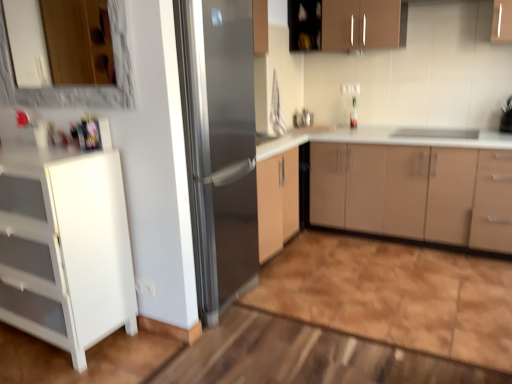
Question: From a real-world perspective, is matte beige cabinet at center, which appears as the second cabinetry when viewed from the top, positioned above or below white glossy cabinet at left, which appears as the third cabinetry when viewed from the top?

Choices:
 (A) below
 (B) above

Answer: (A)

Question: In the image, is matte beige cabinet at center, which is the second cabinetry from bottom to top, positioned in front of or behind white glossy cabinet at left, the 1th cabinetry from the left?

Choices:
 (A) front
 (B) behind

Answer: (B)

Question: Which is nearer to the stainless steel refrigerator at center?

Choices:
 (A) brown matte cabinet at upper center, the third cabinetry when ordered from bottom to top
 (B) satin nickel faucet at upper center
 (C) matte beige cabinet at center, which appears as the second cabinetry when viewed from the top
 (D) white glossy cabinet at left, which ranks as the third cabinetry in right-to-left order
 (E) wooden frame mirror at upper left

Answer: (D)

Question: Which of these objects is positioned closest to the white glossy cabinet at left, which appears as the third cabinetry when viewed from the top?

Choices:
 (A) wooden frame mirror at upper left
 (B) stainless steel refrigerator at center
 (C) brown matte cabinet at upper center, which is counted as the second cabinetry, starting from the left
 (D) satin nickel faucet at upper center
 (E) matte beige cabinet at center, the first cabinetry viewed from the right

Answer: (B)